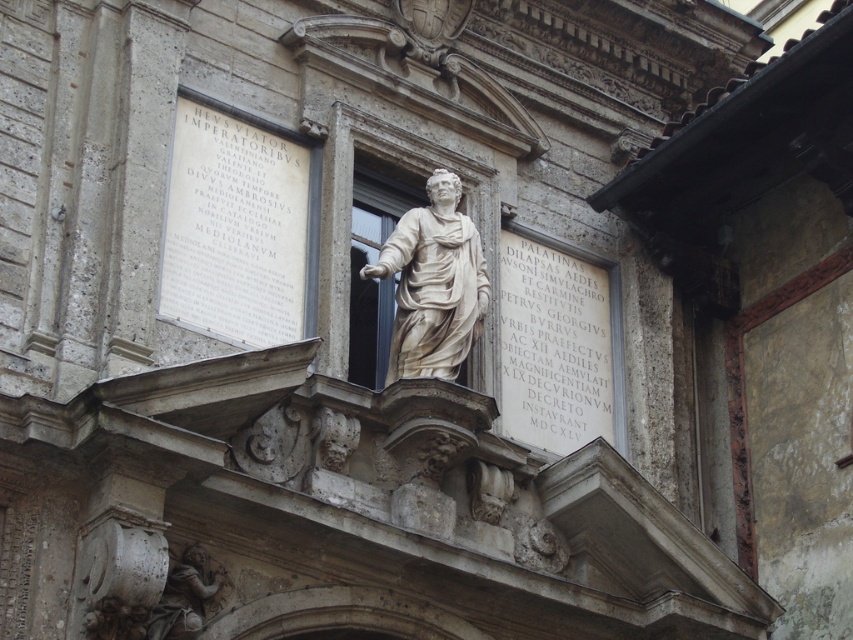
Question: Does white stone plaque at upper left appear on the right side of white stone plaque at center?

Choices:
 (A) no
 (B) yes

Answer: (A)

Question: Estimate the real-world distances between objects in this image. Which object is farther from the white stone plaque at upper left?

Choices:
 (A) white marble cherub at lower left
 (B) light beige marble statue at center
 (C) white stone plaque at center

Answer: (A)

Question: Among these objects, which one is farthest from the camera?

Choices:
 (A) white marble cherub at lower left
 (B) white stone plaque at upper left
 (C) white stone plaque at center
 (D) light beige marble statue at center

Answer: (B)

Question: Which point is farther from the camera taking this photo?

Choices:
 (A) (190, 595)
 (B) (216, 285)
 (C) (421, 348)

Answer: (C)

Question: Can you confirm if white stone plaque at upper left is positioned to the left of light beige marble statue at center?

Choices:
 (A) no
 (B) yes

Answer: (B)

Question: Considering the relative positions of light beige marble statue at center and white marble cherub at lower left in the image provided, where is light beige marble statue at center located with respect to white marble cherub at lower left?

Choices:
 (A) right
 (B) left

Answer: (A)